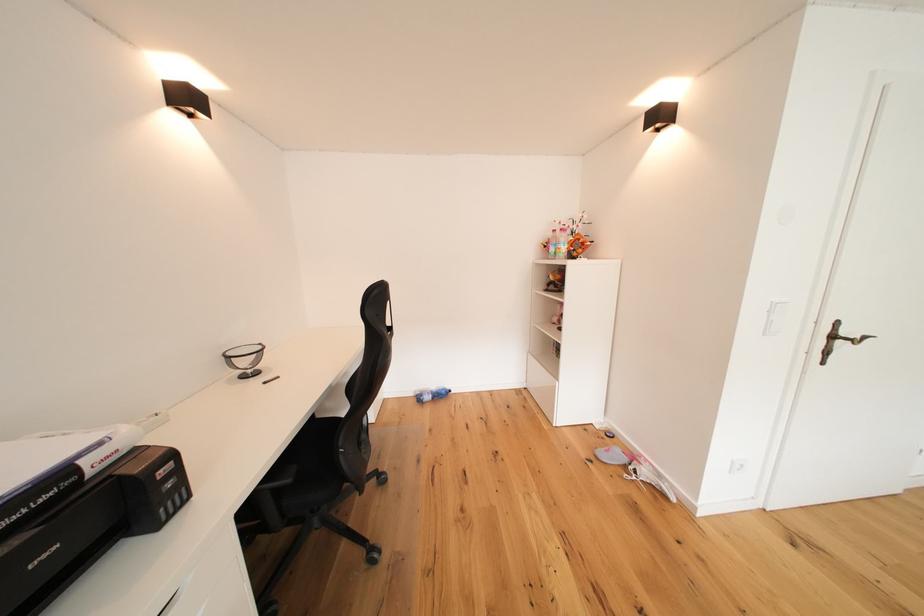
Where would you lift the small black mirror? Please return your answer as a coordinate pair (x, y).

(245, 359)